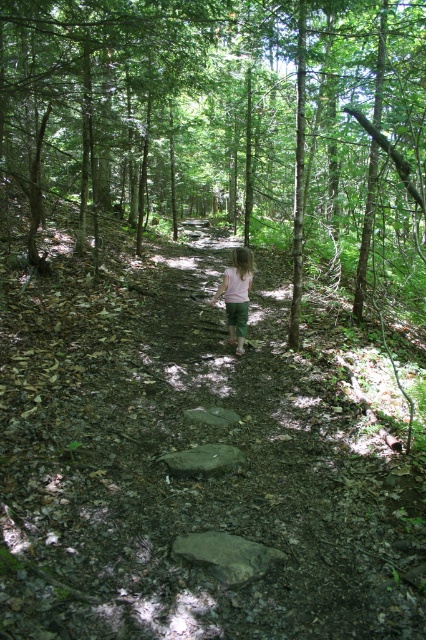
Consider the image. Is white cotton shirt at center to the left of gray smooth rock at center from the viewer's perspective?

No, white cotton shirt at center is not to the left of gray smooth rock at center.

Between white cotton shirt at center and gray smooth rock at center, which one has less height?

With less height is gray smooth rock at center.

Is point (227, 273) positioned before point (218, 417)?

That is False.

Where is `white cotton shirt at center`? white cotton shirt at center is located at coordinates (236, 296).

Which is more to the left, brown rough rock at center or gray smooth rock at center?

Positioned to the left is brown rough rock at center.

Can you confirm if brown rough rock at center is smaller than gray smooth rock at center?

Actually, brown rough rock at center might be larger than gray smooth rock at center.

Looking at this image, who is more forward, (195, 467) or (189, 410)?

Point (195, 467) is more forward.

Identify the location of brown rough rock at center. This screenshot has height=640, width=426. (204, 460).

Is green leafy tree at center above gray rough rock at center?

Yes.

Measure the distance between green leafy tree at center and camera.

→ green leafy tree at center is 9.42 feet away from camera.

Locate an element on the screen. The width and height of the screenshot is (426, 640). green leafy tree at center is located at coordinates (229, 120).